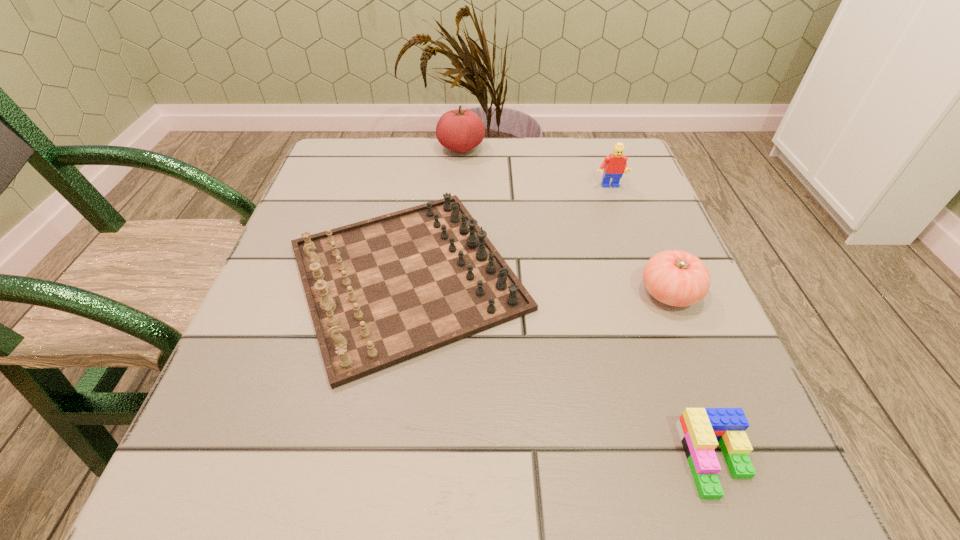
Select which object is the third closest to the shortest object. Please provide its 2D coordinates. Your answer should be formatted as a tuple, i.e. [(x, y)], where the tuple contains the x and y coordinates of a point satisfying the conditions above.

[(614, 165)]

You are a GUI agent. You are given a task and a screenshot of the screen. Output one action in this format:
    pyautogui.click(x=<x>, y=<y>)
    Task: Click on the free space that satisfies the following two spatial constraints: 1. on the front-facing side of the shorter tomato; 2. on the right side of the second farthest object
    This screenshot has height=540, width=960.
    Given the screenshot: What is the action you would take?
    pyautogui.click(x=646, y=293)

Identify the location of vacant region that satisfies the following two spatial constraints: 1. on the front-facing side of the farther Lego; 2. on the right side of the shortest object. (704, 459).

The height and width of the screenshot is (540, 960). Find the location of `free space that satisfies the following two spatial constraints: 1. on the front side of the farthest object; 2. on the right side of the right tomato`. free space that satisfies the following two spatial constraints: 1. on the front side of the farthest object; 2. on the right side of the right tomato is located at coordinates (452, 293).

Where is `vacant space that satisfies the following two spatial constraints: 1. on the front-facing side of the taller Lego; 2. on the left side of the shorter Lego`? The height and width of the screenshot is (540, 960). vacant space that satisfies the following two spatial constraints: 1. on the front-facing side of the taller Lego; 2. on the left side of the shorter Lego is located at coordinates (704, 459).